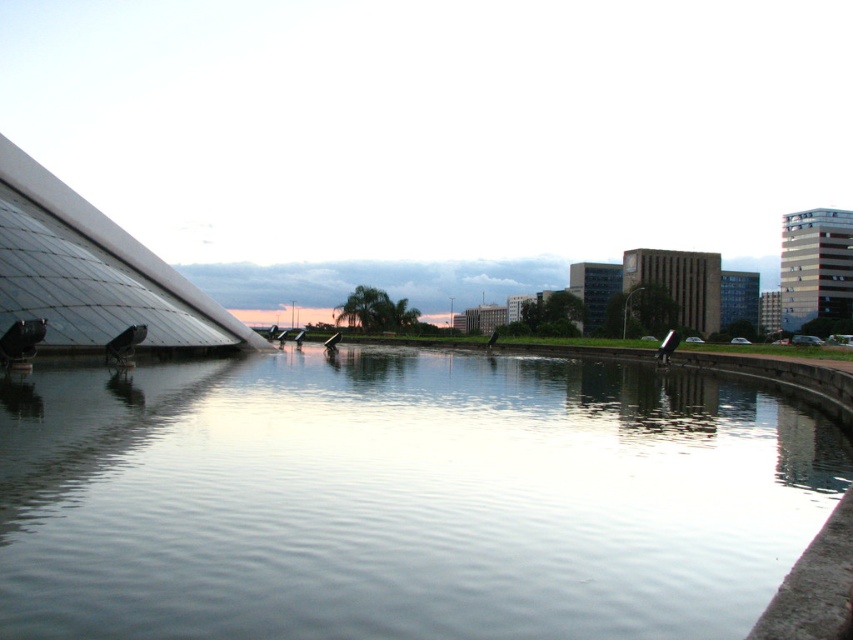
Between clear water at center and transparent glass pyramid at upper left, which one appears on the left side from the viewer's perspective?

transparent glass pyramid at upper left is more to the left.

Is the position of clear water at center more distant than that of transparent glass pyramid at upper left?

No, clear water at center is in front of transparent glass pyramid at upper left.

Between point (682, 561) and point (65, 291), which one is positioned behind?

The point (65, 291) is behind.

This screenshot has height=640, width=853. Identify the location of clear water at center. (402, 497).